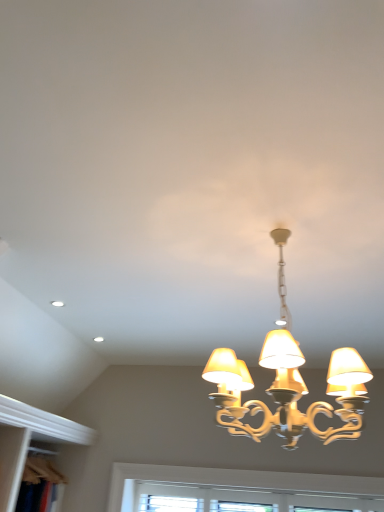
Question: Does gold metallic chandelier at center turn towards white textured window at lower center?

Choices:
 (A) no
 (B) yes

Answer: (A)

Question: Is gold metallic chandelier at center at the left side of white textured window at lower center?

Choices:
 (A) no
 (B) yes

Answer: (B)

Question: Does gold metallic chandelier at center have a lesser height compared to white textured window at lower center?

Choices:
 (A) yes
 (B) no

Answer: (B)

Question: Does gold metallic chandelier at center have a lesser width compared to white textured window at lower center?

Choices:
 (A) no
 (B) yes

Answer: (A)

Question: Is gold metallic chandelier at center smaller than white textured window at lower center?

Choices:
 (A) no
 (B) yes

Answer: (A)

Question: Is gold metallic chandelier at center far from white textured window at lower center?

Choices:
 (A) no
 (B) yes

Answer: (A)

Question: Considering the relative sizes of white textured window at lower center and wooden bookshelf at lower left in the image provided, is white textured window at lower center thinner than wooden bookshelf at lower left?

Choices:
 (A) yes
 (B) no

Answer: (A)

Question: Is white textured window at lower center facing away from wooden bookshelf at lower left?

Choices:
 (A) yes
 (B) no

Answer: (B)

Question: Could you tell me if white textured window at lower center is facing wooden bookshelf at lower left?

Choices:
 (A) no
 (B) yes

Answer: (A)

Question: From the image's perspective, is white textured window at lower center under wooden bookshelf at lower left?

Choices:
 (A) no
 (B) yes

Answer: (B)

Question: Considering the relative sizes of white textured window at lower center and wooden bookshelf at lower left in the image provided, is white textured window at lower center smaller than wooden bookshelf at lower left?

Choices:
 (A) yes
 (B) no

Answer: (A)

Question: From a real-world perspective, is white textured window at lower center positioned under wooden bookshelf at lower left based on gravity?

Choices:
 (A) no
 (B) yes

Answer: (B)

Question: Can you confirm if white textured window at lower center is smaller than gold metallic chandelier at center?

Choices:
 (A) no
 (B) yes

Answer: (B)